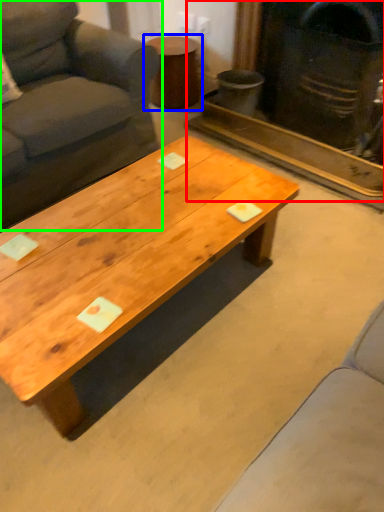
Question: Based on their relative distances, which object is farther from fireplace (highlighted by a red box)? Choose from side table (highlighted by a blue box) and studio couch (highlighted by a green box).

Choices:
 (A) side table
 (B) studio couch

Answer: (B)